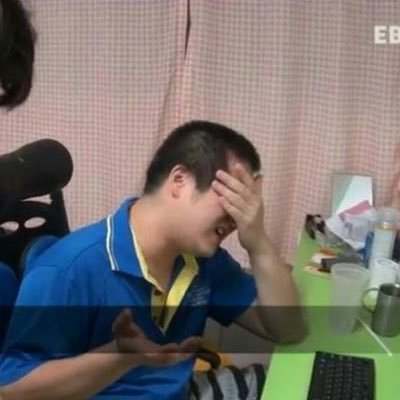
I want to click on mug, so click(x=386, y=309).